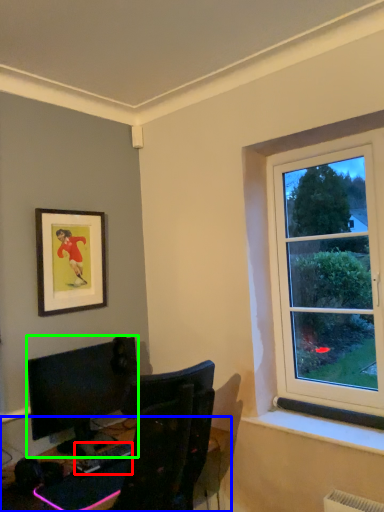
Question: Estimate the real-world distances between objects in this image. Which object is farther from computer keyboard (highlighted by a red box), desk (highlighted by a blue box) or computer monitor (highlighted by a green box)?

Choices:
 (A) desk
 (B) computer monitor

Answer: (B)